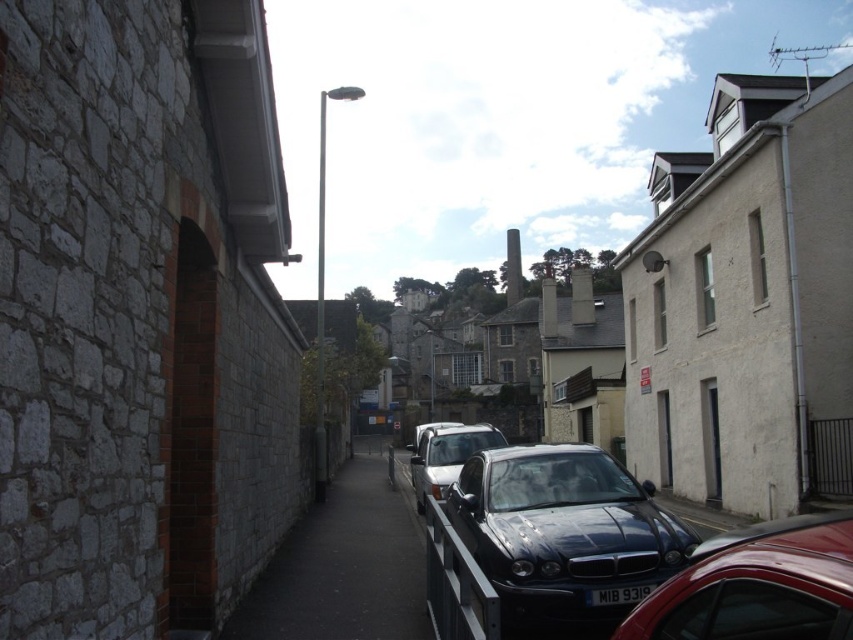
Question: Does glossy black car at center lie in front of metallic silver car at center?

Choices:
 (A) no
 (B) yes

Answer: (B)

Question: Observing the image, what is the correct spatial positioning of glossy black car at center in reference to metallic silver car at center?

Choices:
 (A) left
 (B) right

Answer: (A)

Question: Which object is the farthest from the shiny silver car at center?

Choices:
 (A) black glossy car at center
 (B) metallic silver car at center
 (C) black plastic license plate at center
 (D) black asphalt sidewalk at center

Answer: (C)

Question: Which of these objects is positioned closest to the metallic silver car at center?

Choices:
 (A) black plastic license plate at center
 (B) shiny silver car at center

Answer: (B)

Question: From the image, what is the correct spatial relationship of black plastic license plate at center in relation to shiny silver car at center?

Choices:
 (A) below
 (B) above

Answer: (B)

Question: Which of the following is the closest to the observer?

Choices:
 (A) glossy black car at center
 (B) black asphalt sidewalk at center
 (C) metallic silver car at center
 (D) black plastic license plate at center

Answer: (A)